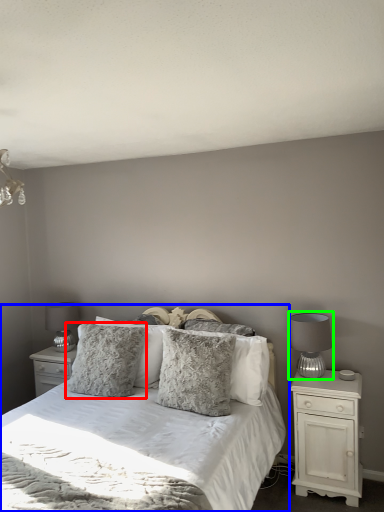
Question: Based on their relative distances, which object is nearer to pillow (highlighted by a red box)? Choose from bed (highlighted by a blue box) and table lamp (highlighted by a green box).

Choices:
 (A) bed
 (B) table lamp

Answer: (A)